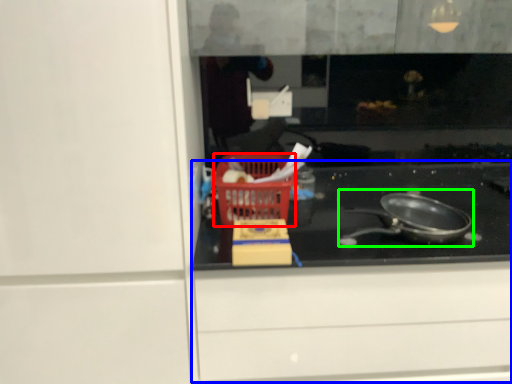
Question: Based on their relative distances, which object is farther from basket (highlighted by a red box)? Choose from cabinetry (highlighted by a blue box) and frying pan (highlighted by a green box).

Choices:
 (A) cabinetry
 (B) frying pan

Answer: (B)